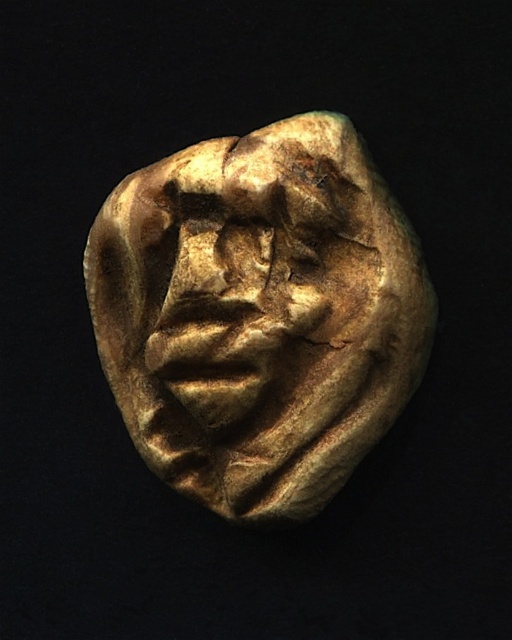
Between gold textured mask at center and golden textured mask at center, which one appears on the right side from the viewer's perspective?

From the viewer's perspective, gold textured mask at center appears more on the right side.

Who is higher up, gold textured mask at center or golden textured mask at center?

golden textured mask at center is above.

Which is in front, point (159, 220) or point (161, 332)?

Point (159, 220)

Where is `gold textured mask at center`? This screenshot has width=512, height=640. gold textured mask at center is located at coordinates (259, 314).